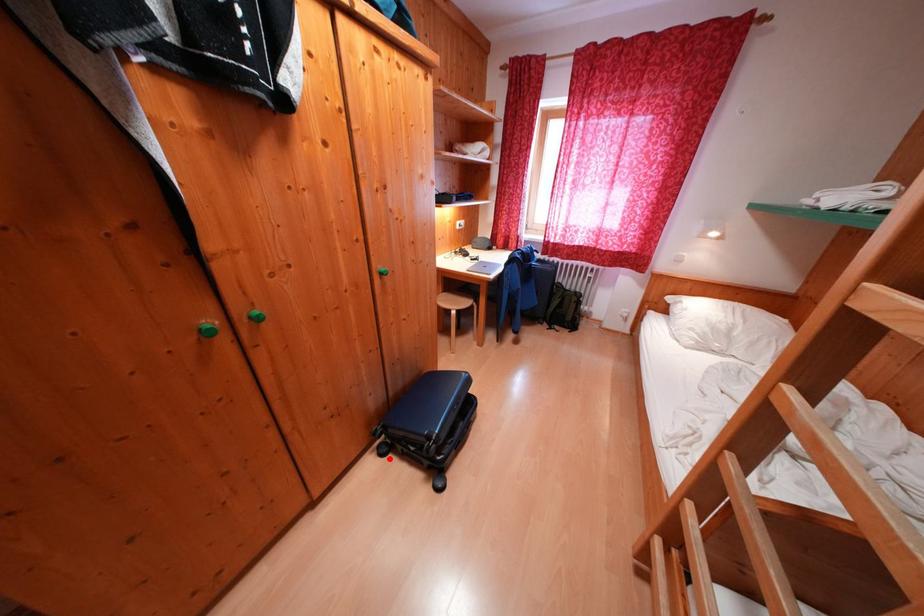
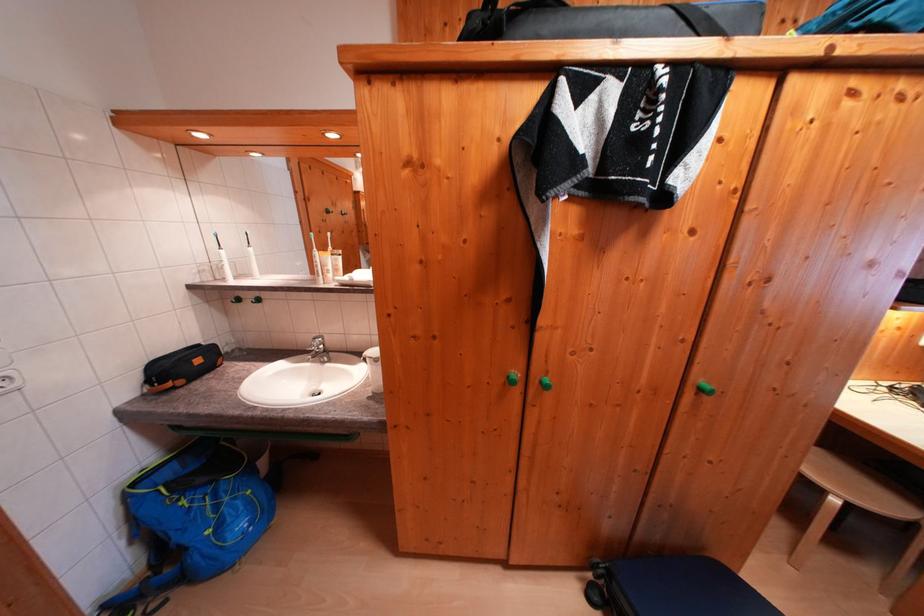
Question: I am providing you with two images of the same scene from different viewpoints. Image1 has a red point marked. In image2, the corresponding 3D location appears at what relative position? Reply with the corresponding letter.

Choices:
 (A) Closer
 (B) Farther

Answer: (A)